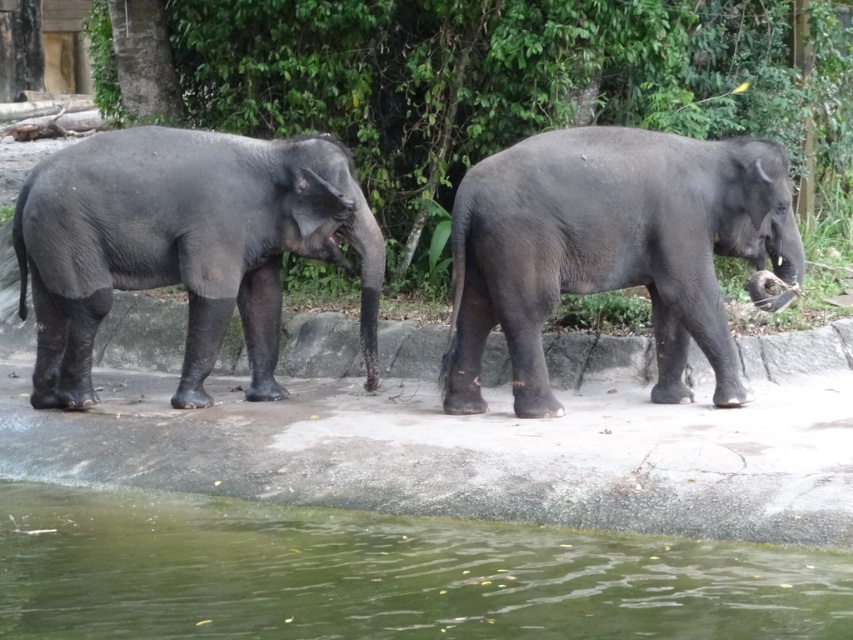
Question: Which object appears farthest from the camera in this image?

Choices:
 (A) green liquid water at lower center
 (B) gray matte elephant at right
 (C) gray matte elephant at left

Answer: (C)

Question: Which point is closer to the camera?

Choices:
 (A) green liquid water at lower center
 (B) gray matte elephant at left
 (C) gray matte elephant at right

Answer: (A)

Question: Can you confirm if gray matte elephant at right is thinner than gray matte elephant at left?

Choices:
 (A) yes
 (B) no

Answer: (A)

Question: In this image, where is green liquid water at lower center located relative to gray matte elephant at left?

Choices:
 (A) left
 (B) right

Answer: (B)

Question: Does green liquid water at lower center appear on the left side of gray matte elephant at left?

Choices:
 (A) no
 (B) yes

Answer: (A)

Question: Estimate the real-world distances between objects in this image. Which object is farther from the gray matte elephant at left?

Choices:
 (A) green liquid water at lower center
 (B) gray matte elephant at right

Answer: (A)